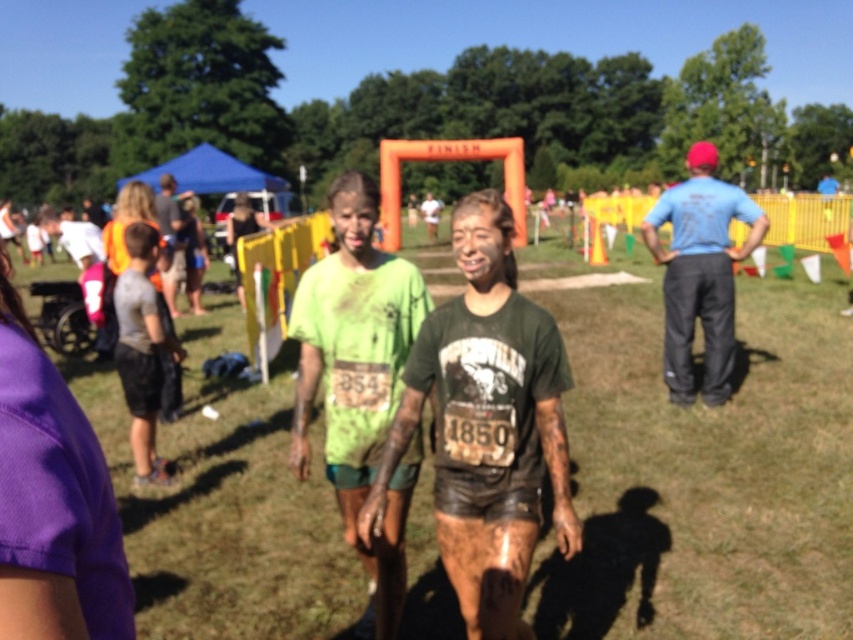
Question: Which object is closer to the camera taking this photo?

Choices:
 (A) blue cotton shirt at right
 (B) orange safety vest at left
 (C) green matte shirt at center

Answer: (C)

Question: Does muddy green t-shirt at center appear over blue cotton shirt at right?

Choices:
 (A) no
 (B) yes

Answer: (A)

Question: Which object is positioned farthest from the purple fabric at lower left?

Choices:
 (A) green t-shirt at center
 (B) muddy green t-shirt at center
 (C) green matte shirt at center

Answer: (A)

Question: Which of these objects is positioned farthest from the orange safety vest at left?

Choices:
 (A) muddy green t-shirt at center
 (B) blue cotton shirt at right
 (C) green t-shirt at center
 (D) purple fabric at lower left

Answer: (B)

Question: Can you confirm if purple fabric at lower left is bigger than orange safety vest at left?

Choices:
 (A) yes
 (B) no

Answer: (B)

Question: Is orange safety vest at left smaller than green t-shirt at center?

Choices:
 (A) yes
 (B) no

Answer: (B)